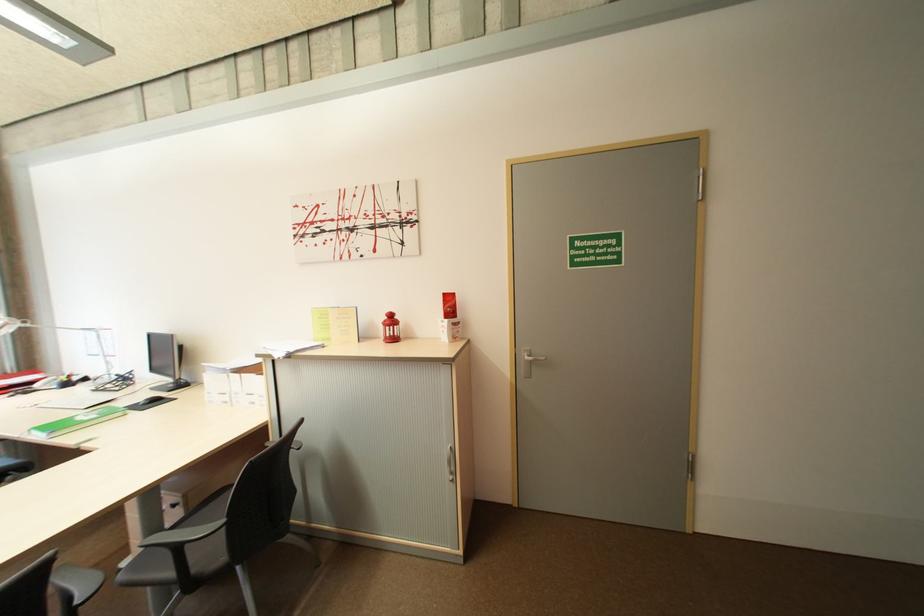
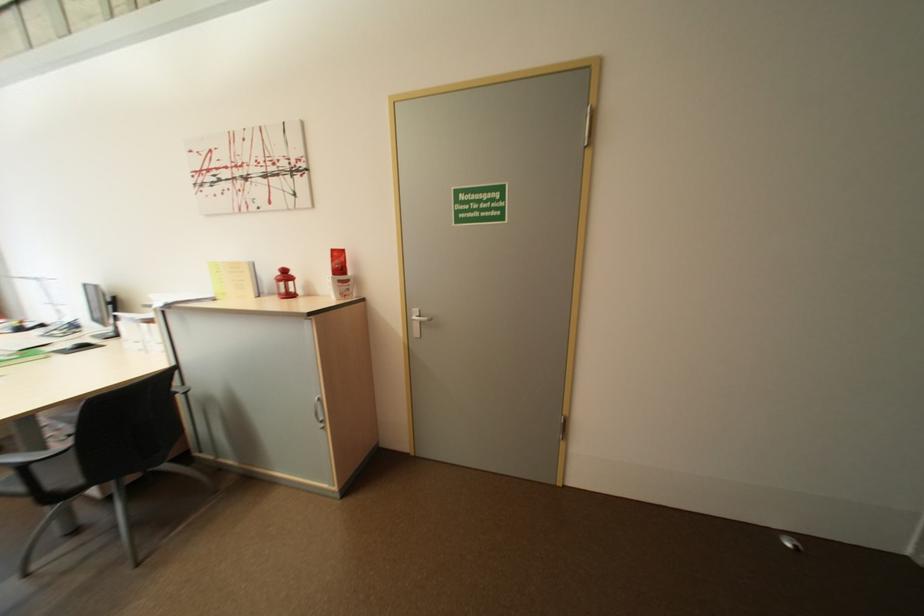
Question: The images are taken continuously from a first-person perspective. In which direction is your viewpoint rotating?

Choices:
 (A) Left
 (B) Right
 (C) Up
 (D) Down

Answer: (D)